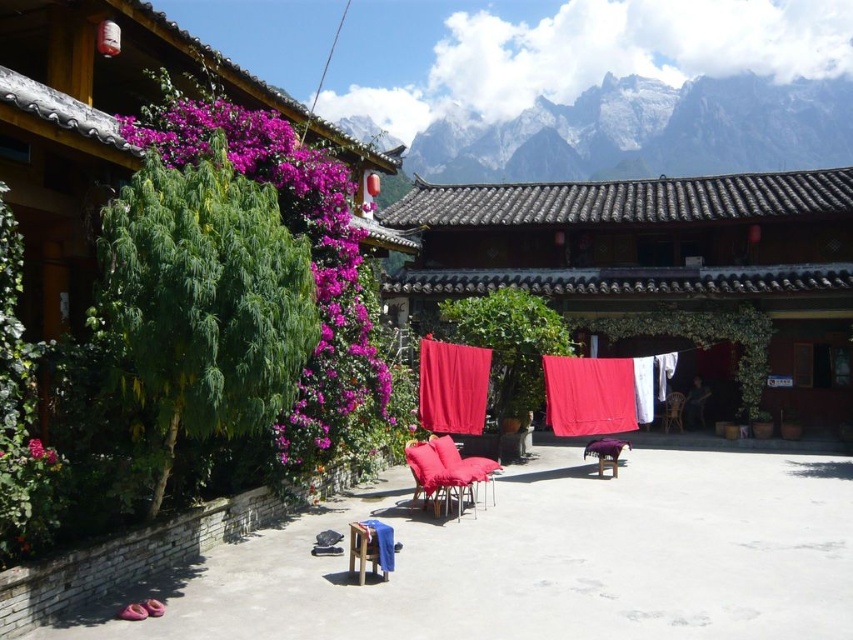
Can you confirm if matte red armchair at center is shorter than blue cotton blanket at lower center?

In fact, matte red armchair at center may be taller than blue cotton blanket at lower center.

Between point (474, 474) and point (376, 560), which one is positioned behind?

The point (474, 474) is more distant.

Between point (434, 476) and point (370, 531), which one is positioned behind?

Point (434, 476)

Where is `matte red armchair at center`? This screenshot has width=853, height=640. matte red armchair at center is located at coordinates (445, 468).

Is white rocky mountain at upper center taller than purple matte flower at upper left?

Correct, white rocky mountain at upper center is much taller as purple matte flower at upper left.

Is the position of white rocky mountain at upper center more distant than that of purple matte flower at upper left?

Yes, it is behind purple matte flower at upper left.

Which is in front, point (779, 138) or point (38, 458)?

Point (38, 458) is in front.

The height and width of the screenshot is (640, 853). In order to click on white rocky mountain at upper center in this screenshot , I will do `click(648, 132)`.

Which of these two, white rocky mountain at upper center or red matte curtain at center, stands taller?

white rocky mountain at upper center is taller.

Where is `white rocky mountain at upper center`? The height and width of the screenshot is (640, 853). white rocky mountain at upper center is located at coordinates (648, 132).

Is point (437, 138) more distant than point (604, 365)?

Yes.

Identify the location of white rocky mountain at upper center. The image size is (853, 640). (648, 132).